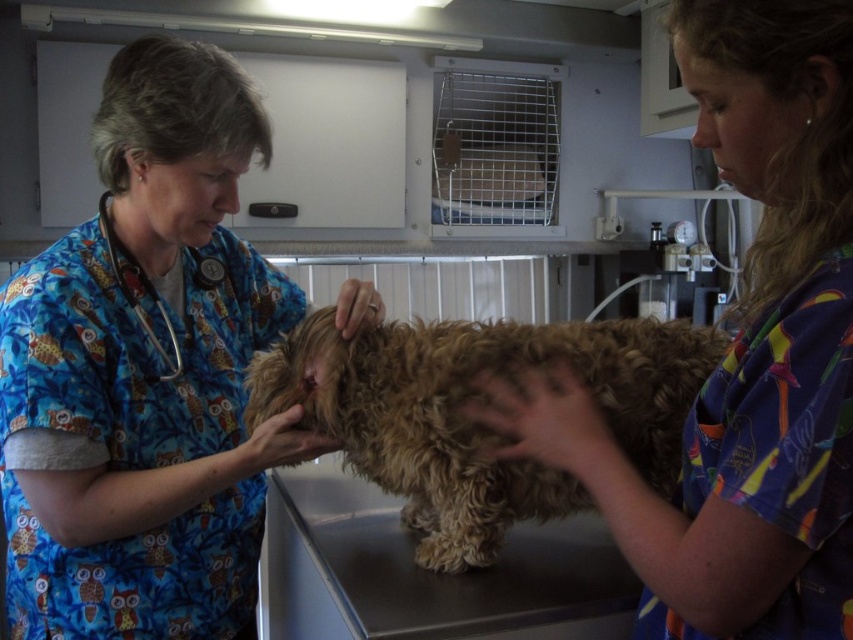
You are a patient in the veterinary clinic and need to locate the stethoscope for an emergency. Based on the scene, which object is closer to the ceiling between the blue printed scrubs at center and the blue fabric stethoscope at left?

The blue printed scrubs at center is taller than the blue fabric stethoscope at left, so the blue printed scrubs at center is closer to the ceiling.

Looking at this image, you are a veterinary assistant and need to place a new medical chart holder between the two points, point [830,536] and point [329,396]. Which point should the chart holder be closer to if it needs to be easily accessible from your current position?

The chart holder should be placed closer to point [830,536] because it is closer to the viewer than point [329,396], making it more accessible from your current position.

You are a patient in the veterinary clinic and need to identify which object is higher in the image. The multicolored scrubs at center and the curly golden fur at center are both visible. Which one is taller?

The multicolored scrubs at center is taller than the curly golden fur at center.